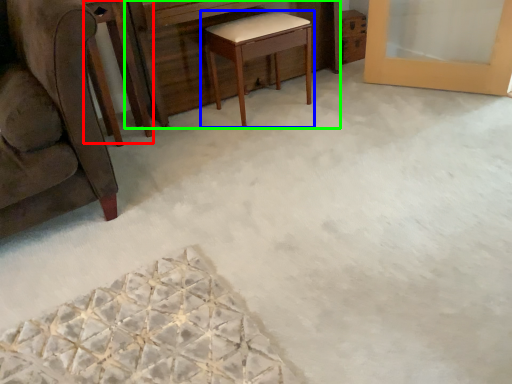
Question: Considering the real-world distances, which object is closest to round table (highlighted by a red box)? table (highlighted by a blue box) or vanity (highlighted by a green box).

Choices:
 (A) table
 (B) vanity

Answer: (B)